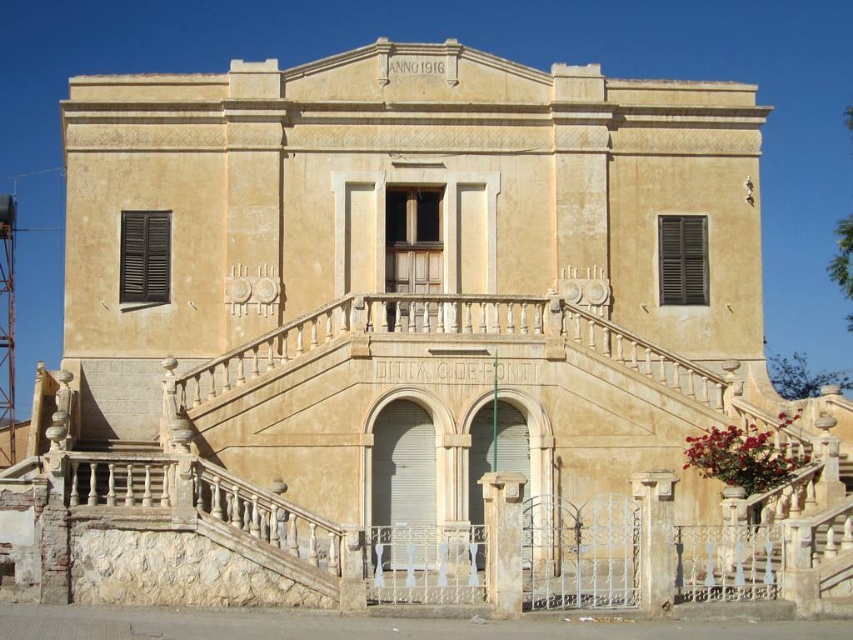
Who is taller, matte black shutters at left or dark wood shutters at center?

Standing taller between the two is dark wood shutters at center.

Does matte black shutters at left have a smaller size compared to dark wood shutters at center?

Indeed, matte black shutters at left has a smaller size compared to dark wood shutters at center.

Between point (120, 250) and point (675, 240), which one is positioned behind?

Positioned behind is point (675, 240).

Identify the location of matte black shutters at left. This screenshot has width=853, height=640. (144, 257).